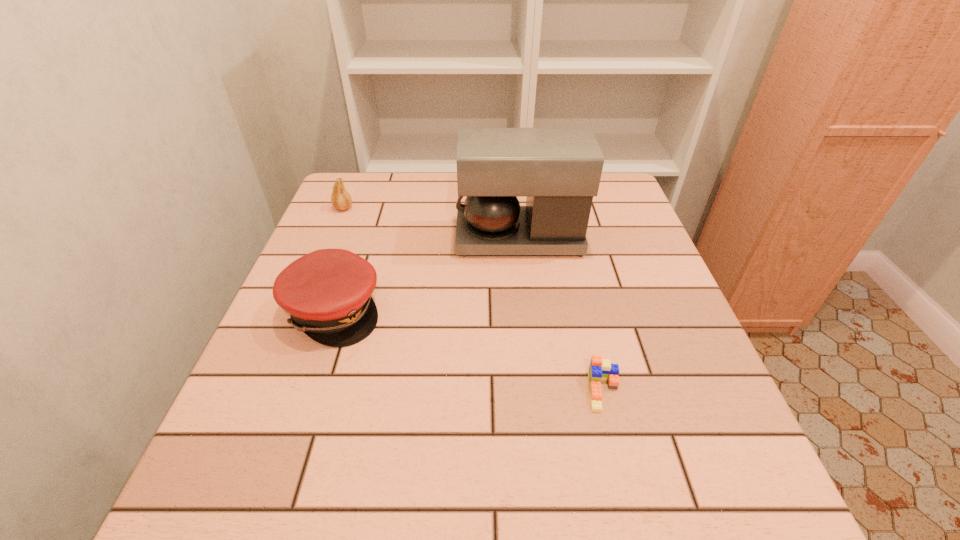
Find the location of a particular element. the second farthest object is located at coordinates (559, 169).

Identify the location of coffee maker. (559, 169).

Where is `cap`? This screenshot has width=960, height=540. cap is located at coordinates (327, 293).

This screenshot has height=540, width=960. Identify the location of the farthest object. (340, 199).

Where is `Lego`? Lego is located at coordinates (599, 369).

At what (x,y) coordinates should I click in order to perform the action: click on the shortest object. Please return your answer as a coordinate pair (x, y). The image size is (960, 540). Looking at the image, I should click on (599, 369).

At what (x,y) coordinates should I click in order to perform the action: click on free space located on the carafe side of the tallest object. Please return your answer as a coordinate pair (x, y). The width and height of the screenshot is (960, 540). Looking at the image, I should click on (370, 238).

The image size is (960, 540). I want to click on free space located 0.150m on the carafe side of the tallest object, so click(x=397, y=238).

At what (x,y) coordinates should I click in order to perform the action: click on free spot located on the carafe side of the tallest object. Please return your answer as a coordinate pair (x, y). The height and width of the screenshot is (540, 960). Looking at the image, I should click on (421, 238).

The height and width of the screenshot is (540, 960). I want to click on vacant space located 0.350m at the front of the second nearest object where the visor is located, so click(x=547, y=310).